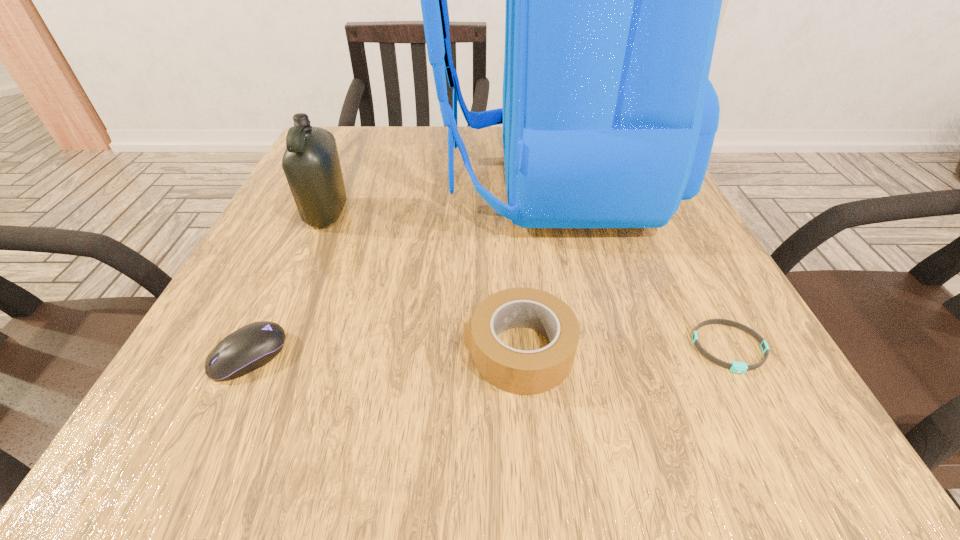
At what (x,y) coordinates should I click in order to perform the action: click on free space between the third tallest object and the tallest object. Please return your answer as a coordinate pair (x, y). The image size is (960, 540). Looking at the image, I should click on (534, 267).

Identify the location of vacant area that lies between the bottle and the third shortest object. (423, 282).

You are a GUI agent. You are given a task and a screenshot of the screen. Output one action in this format:
    pyautogui.click(x=<x>, y=<y>)
    Task: Click on the vacant point located between the bottle and the third tallest object
    
    Given the screenshot: What is the action you would take?
    pyautogui.click(x=423, y=282)

Where is `vacant area that lies between the second shortest object and the fourth shortest object`? This screenshot has height=540, width=960. vacant area that lies between the second shortest object and the fourth shortest object is located at coordinates (288, 285).

The image size is (960, 540). I want to click on free spot between the fourth tallest object and the tallest object, so pyautogui.click(x=398, y=269).

Locate an element on the screen. free space between the computer mouse and the duct tape is located at coordinates (384, 353).

You are a GUI agent. You are given a task and a screenshot of the screen. Output one action in this format:
    pyautogui.click(x=<x>, y=<y>)
    Task: Click on the fourth closest object to the shortest object
    The image size is (960, 540).
    Given the screenshot: What is the action you would take?
    pyautogui.click(x=311, y=164)

Identify the location of object that stands as the third closest to the fourth tallest object. Image resolution: width=960 pixels, height=540 pixels. (613, 0).

At what (x,y) coordinates should I click in order to perform the action: click on vacant region that satisfies the following two spatial constraints: 1. on the back of the tallest object; 2. on the front side of the bottle. Please return your answer as a coordinate pair (x, y). Looking at the image, I should click on (554, 213).

The image size is (960, 540). I want to click on free point that satisfies the following two spatial constraints: 1. on the buckle of the shortest object; 2. at the edge of the third shortest object, so click(x=731, y=350).